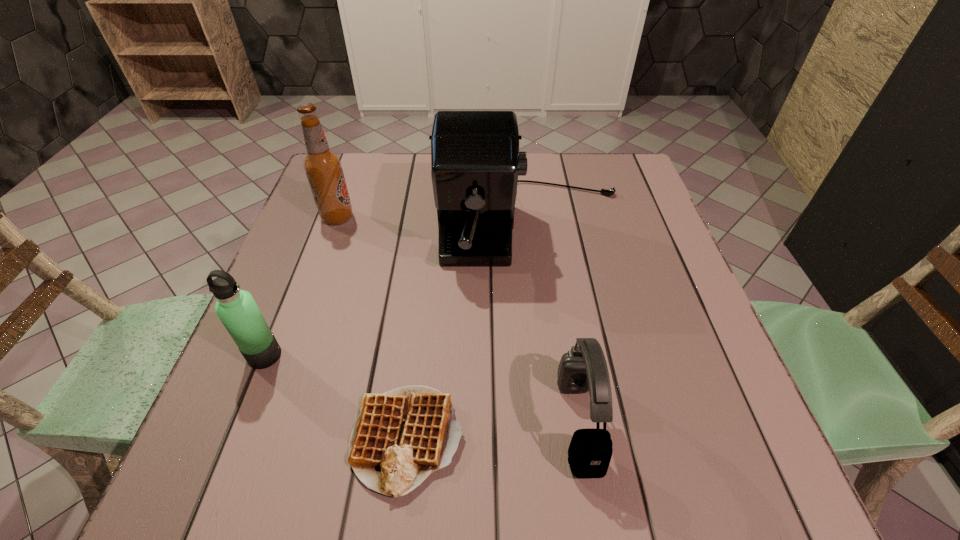
This screenshot has width=960, height=540. I want to click on empty space between the thermos bottle and the shortest object, so click(x=336, y=397).

The height and width of the screenshot is (540, 960). I want to click on vacant region between the beer bottle and the headset, so click(x=458, y=320).

Identify which object is the fourth nearest to the thermos bottle. Please provide its 2D coordinates. Your answer should be formatted as a tuple, i.e. [(x, y)], where the tuple contains the x and y coordinates of a point satisfying the conditions above.

[(583, 368)]

Where is `object that is the fourth closest to the waffle`? The image size is (960, 540). object that is the fourth closest to the waffle is located at coordinates (323, 167).

Find the location of `free space in the image that satisfies the following two spatial constraints: 1. on the front label of the shortest object; 2. on the left side of the beer bottle`. free space in the image that satisfies the following two spatial constraints: 1. on the front label of the shortest object; 2. on the left side of the beer bottle is located at coordinates (258, 439).